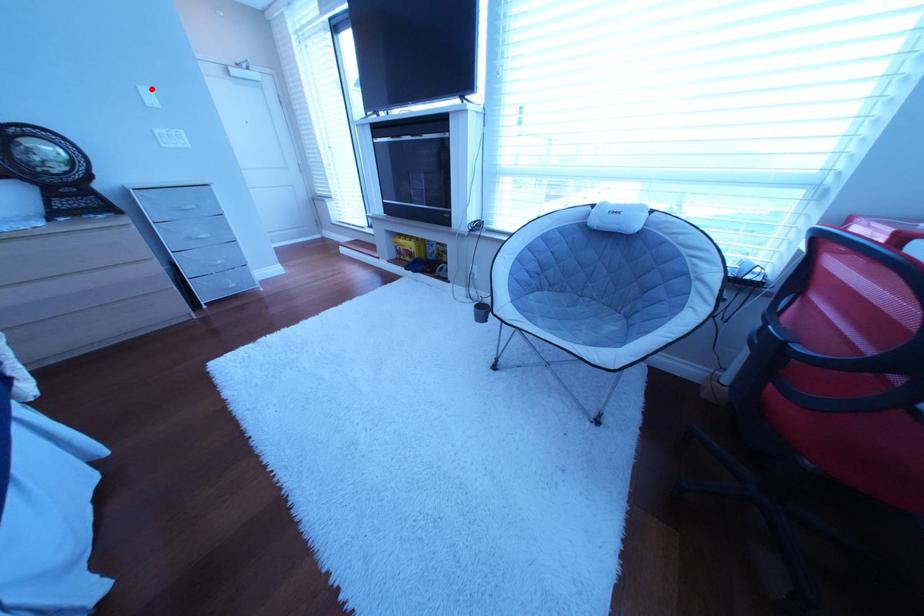
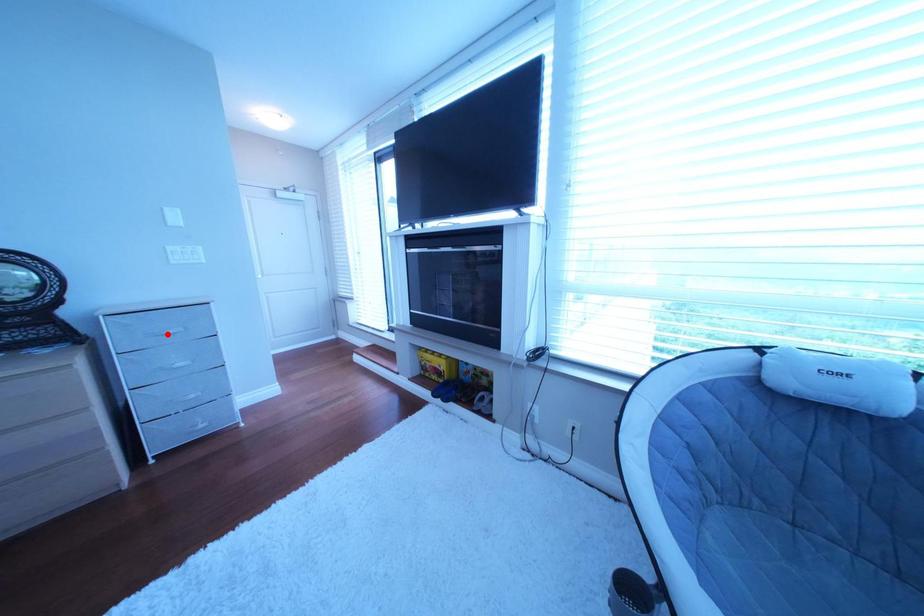
I am providing you with two images of the same scene from different viewpoints. A red point is marked on the first image and another point is marked on the second image. Is the red point in image1 aligned with the point shown in image2?

No